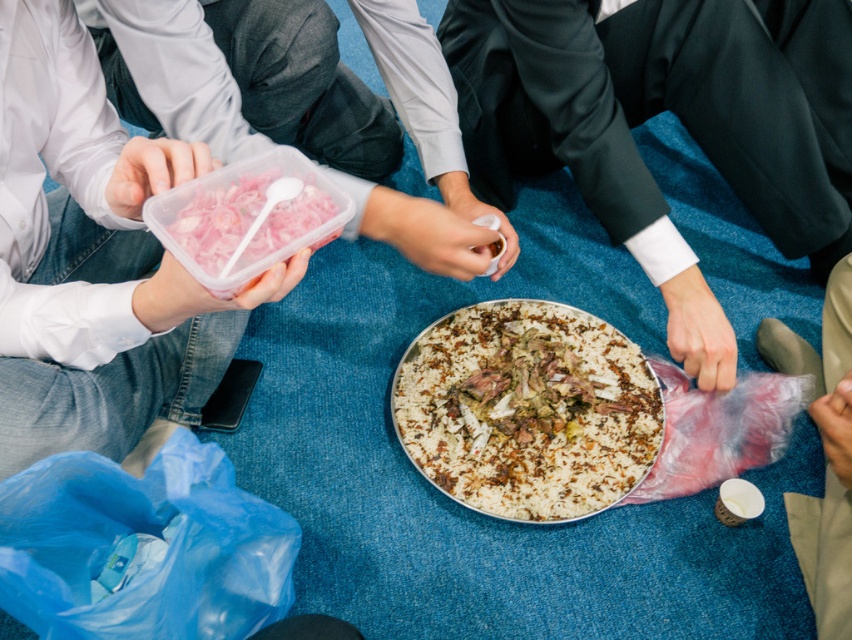
Who is lower down, white rice with meat at center or translucent plastic container with pink shredded food at center?

white rice with meat at center is below.

Can you confirm if white rice with meat at center is shorter than translucent plastic container with pink shredded food at center?

No, white rice with meat at center is not shorter than translucent plastic container with pink shredded food at center.

At what (x,y) coordinates should I click in order to perform the action: click on white rice with meat at center. Please return your answer as a coordinate pair (x, y). Looking at the image, I should click on (528, 410).

Does translucent plastic container at upper left lie in front of white rice with meat at center?

Yes, translucent plastic container at upper left is in front of white rice with meat at center.

The width and height of the screenshot is (852, 640). What do you see at coordinates (93, 259) in the screenshot?
I see `translucent plastic container at upper left` at bounding box center [93, 259].

Locate an element on the screen. The height and width of the screenshot is (640, 852). translucent plastic container at upper left is located at coordinates (93, 259).

Who is more forward, (181, 243) or (830, 324)?

Point (181, 243) is more forward.

Between translucent plastic container with pink shredded food at center and clear plastic bag at lower right, which one is positioned lower?

clear plastic bag at lower right is lower down.

Is point (278, 212) positioned in front of point (832, 554)?

Yes, it is.

Locate an element on the screen. translucent plastic container with pink shredded food at center is located at coordinates (246, 218).